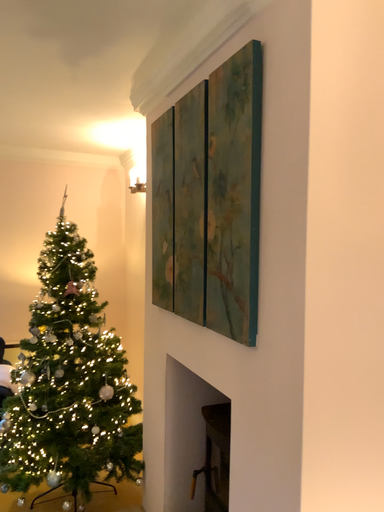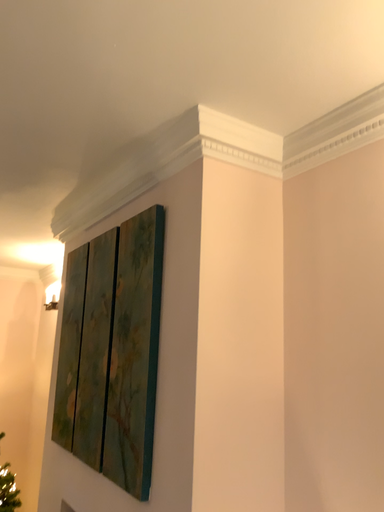
Question: Which way did the camera rotate in the video?

Choices:
 (A) rotated downward
 (B) rotated upward

Answer: (B)